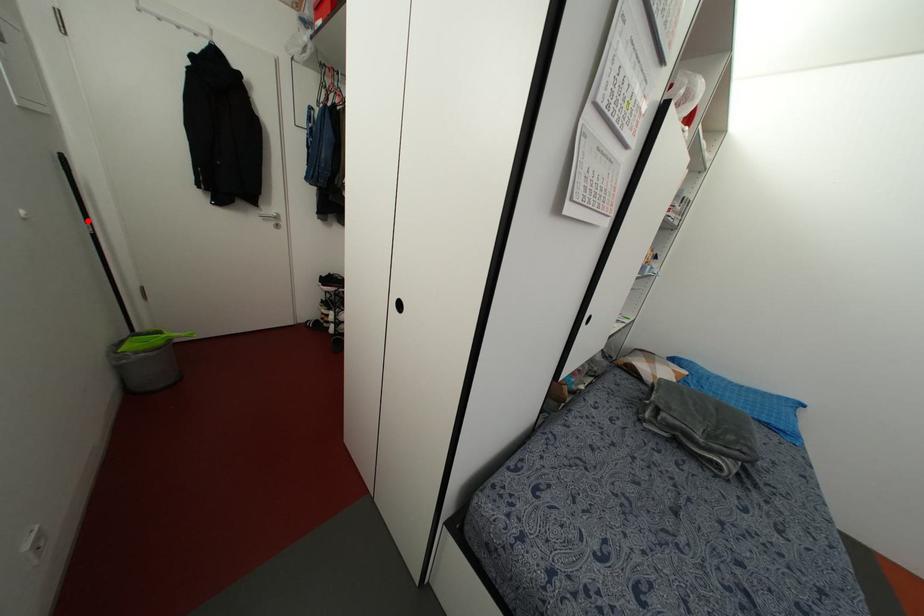
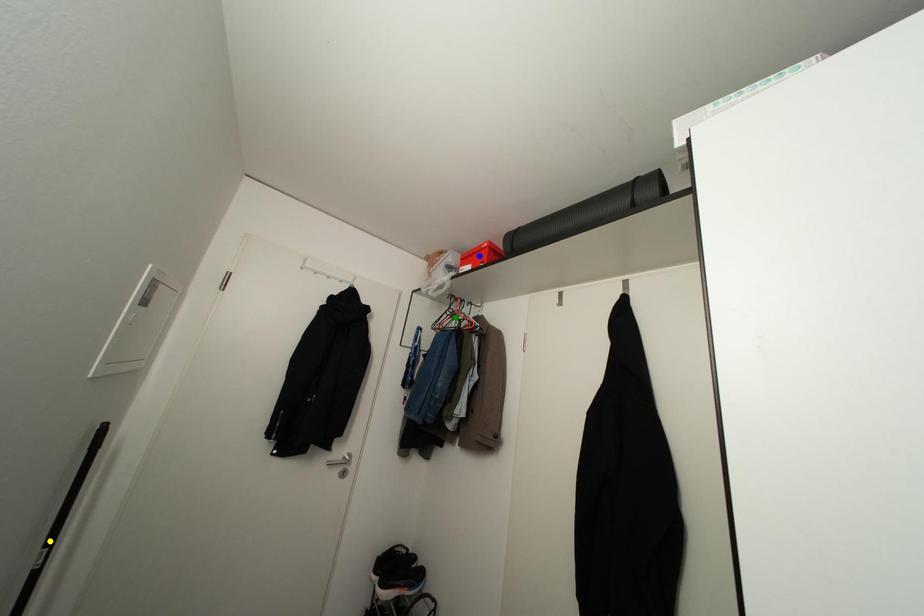
Question: I am providing you with two images of the same scene from different viewpoints. A red point is marked on the first image. You are given multiple points on the second image. Which point in image 2 represents the same 3d spot as the red point in image 1?

Choices:
 (A) green point
 (B) yellow point
 (C) blue point

Answer: (B)